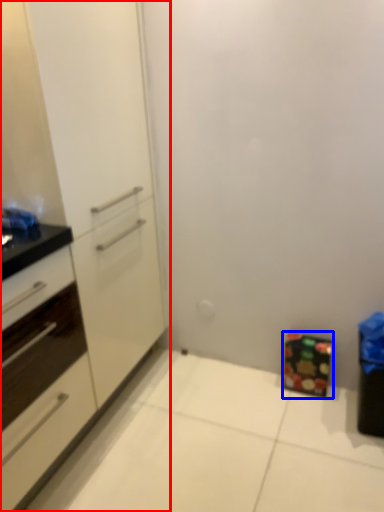
Question: Which object appears closest to the camera in this image, cabinetry (highlighted by a red box) or cabinetry (highlighted by a blue box)?

Choices:
 (A) cabinetry
 (B) cabinetry

Answer: (A)